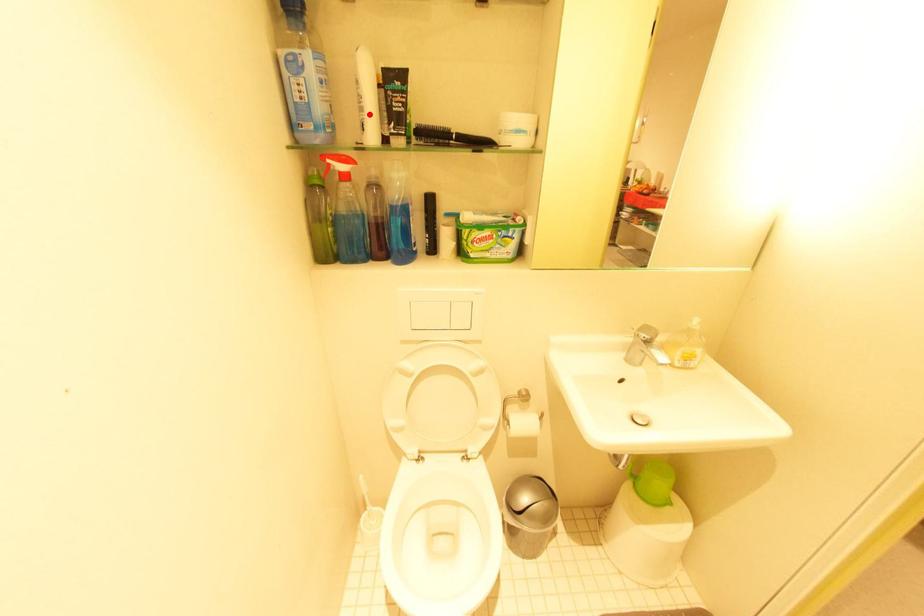
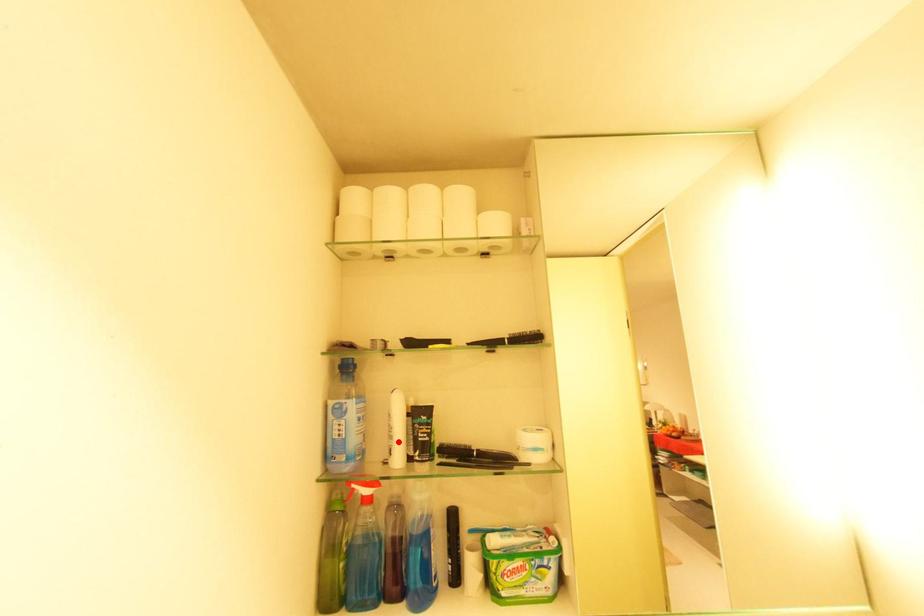
I am providing you with two images of the same scene from different viewpoints. A red point is marked on the first image and another point is marked on the second image. Is the marked point in image1 the same physical position as the marked point in image2?

Yes